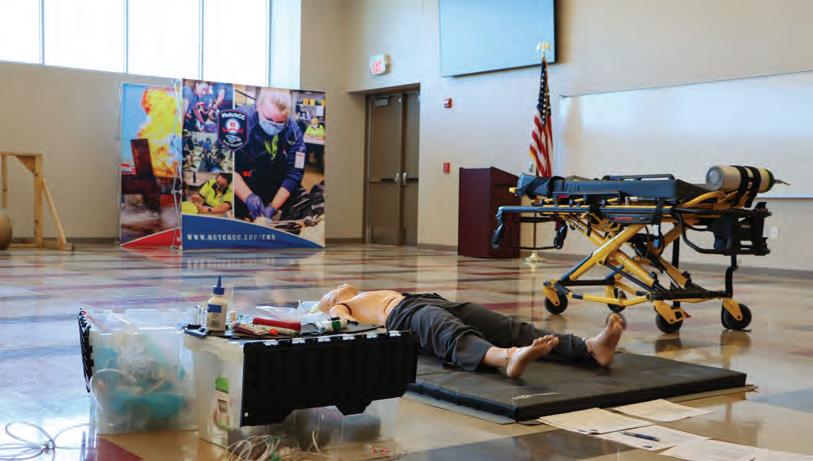
Locate an element on the screen. frame is located at coordinates (124, 55).